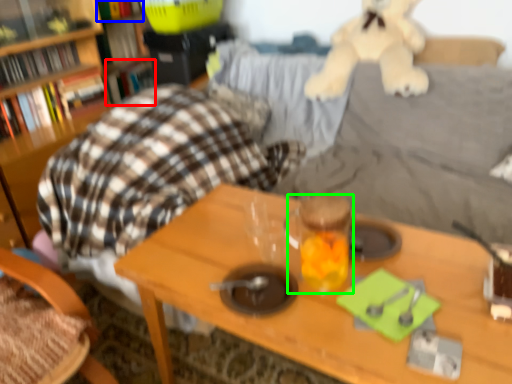
Question: Considering the real-world distances, which object is closest to book (highlighted by a red box)? book (highlighted by a blue box) or beverage (highlighted by a green box).

Choices:
 (A) book
 (B) beverage

Answer: (A)